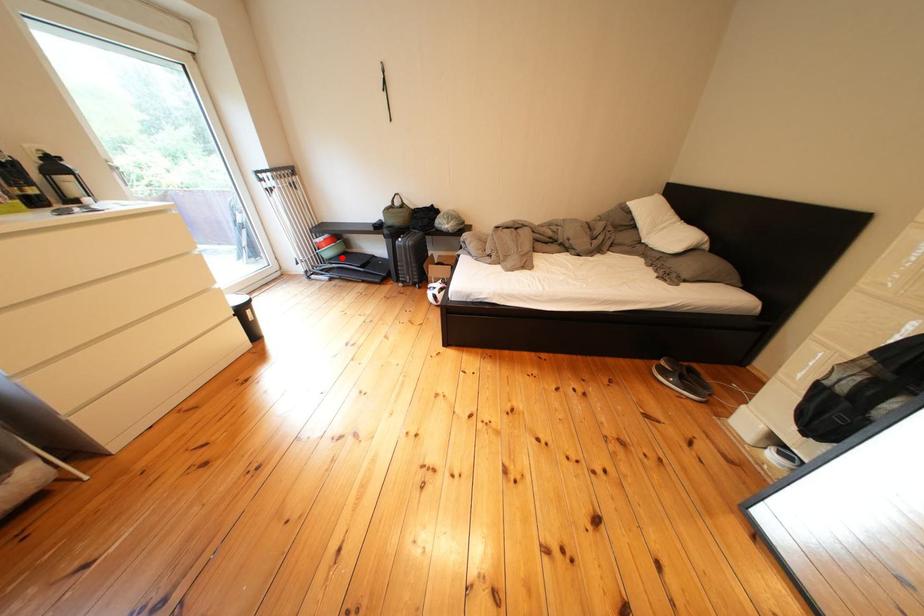
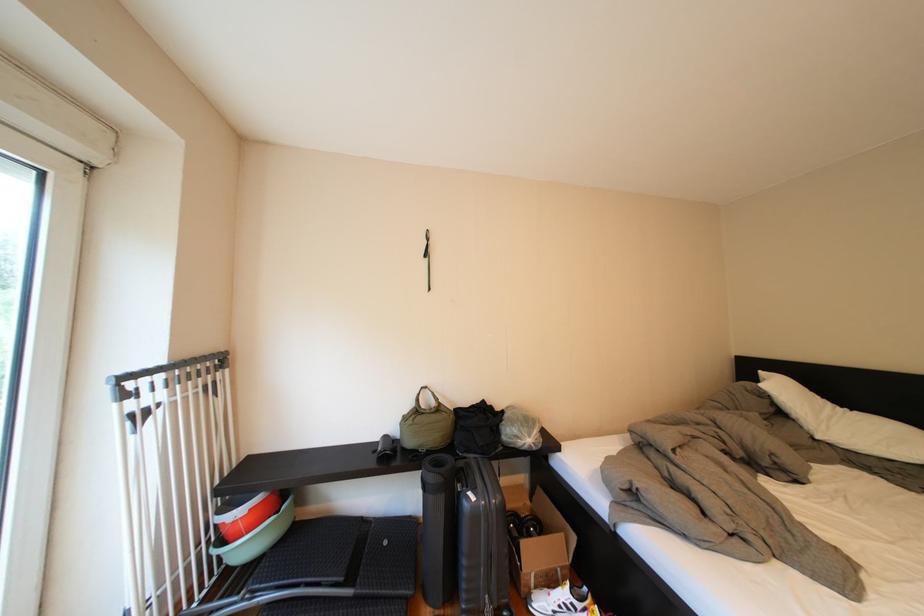
Locate, in the second image, the point that corresponds to the highlighted location in the first image.

(261, 551)